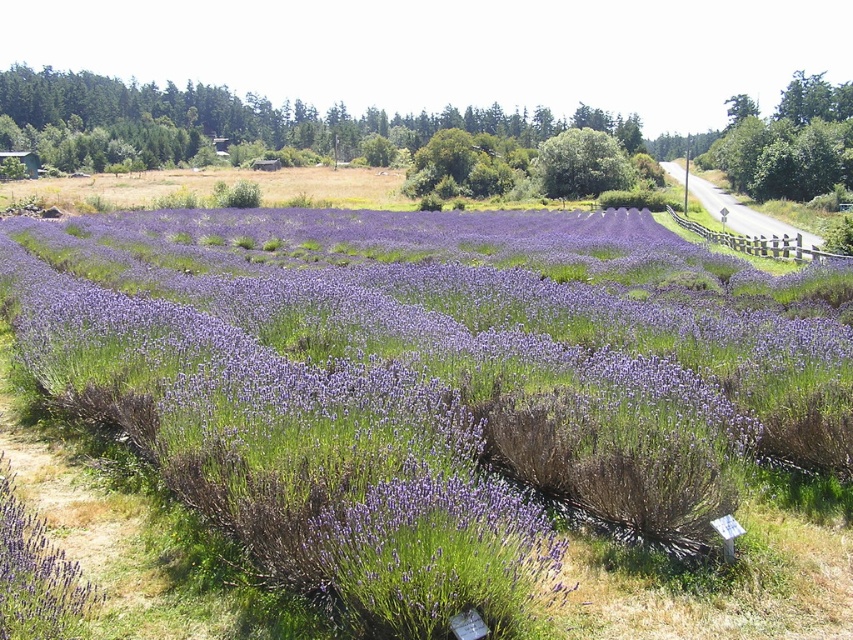
Question: Is purple soft-textured lavender at center to the right of purple matte lavender at lower left from the viewer's perspective?

Choices:
 (A) no
 (B) yes

Answer: (A)

Question: Among these objects, which one is nearest to the camera?

Choices:
 (A) purple soft-textured lavender at center
 (B) purple matte lavender at lower left

Answer: (B)

Question: Which point appears farthest from the camera in this image?

Choices:
 (A) (715, 387)
 (B) (22, 524)

Answer: (A)

Question: Does purple soft-textured lavender at center have a lesser width compared to purple matte lavender at lower left?

Choices:
 (A) yes
 (B) no

Answer: (B)

Question: Which point is closer to the camera?

Choices:
 (A) purple soft-textured lavender at center
 (B) purple matte lavender at lower left

Answer: (B)

Question: Does purple soft-textured lavender at center have a smaller size compared to purple matte lavender at lower left?

Choices:
 (A) yes
 (B) no

Answer: (B)